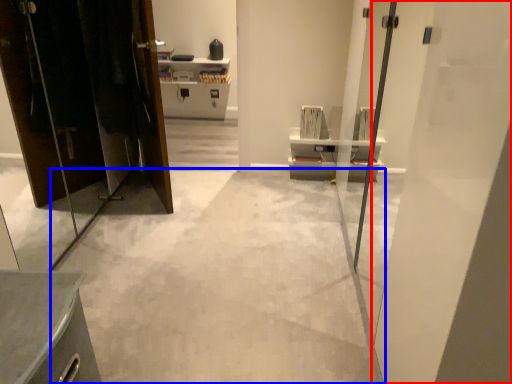
Question: Which object is further to the camera taking this photo, door (highlighted by a red box) or concrete (highlighted by a blue box)?

Choices:
 (A) door
 (B) concrete

Answer: (B)